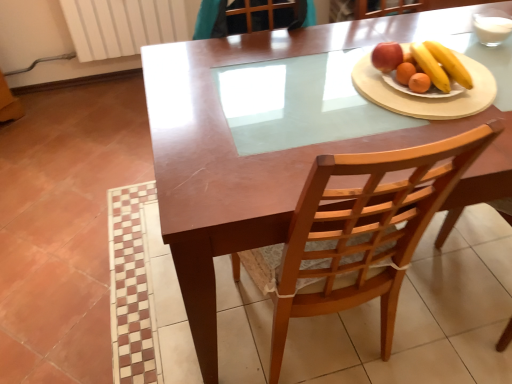
Question: From the image's perspective, is smooth wooden plate with fruits at right located above white ceramic plate at upper right?

Choices:
 (A) yes
 (B) no

Answer: (A)

Question: Would you say smooth wooden plate with fruits at right contains white ceramic plate at upper right?

Choices:
 (A) yes
 (B) no

Answer: (B)

Question: Is there a large distance between smooth wooden plate with fruits at right and white ceramic plate at upper right?

Choices:
 (A) yes
 (B) no

Answer: (B)

Question: Is smooth wooden plate with fruits at right wider than white ceramic plate at upper right?

Choices:
 (A) no
 (B) yes

Answer: (A)

Question: Does smooth wooden plate with fruits at right have a greater height compared to white ceramic plate at upper right?

Choices:
 (A) no
 (B) yes

Answer: (B)

Question: Considering the relative sizes of smooth wooden plate with fruits at right and white ceramic plate at upper right in the image provided, is smooth wooden plate with fruits at right bigger than white ceramic plate at upper right?

Choices:
 (A) yes
 (B) no

Answer: (B)

Question: Is smooth wooden plate with fruits at right positioned beyond the bounds of wooden chair at center?

Choices:
 (A) no
 (B) yes

Answer: (B)

Question: Does smooth wooden plate with fruits at right come in front of wooden chair at center?

Choices:
 (A) no
 (B) yes

Answer: (A)

Question: Can you confirm if smooth wooden plate with fruits at right is wider than wooden chair at center?

Choices:
 (A) yes
 (B) no

Answer: (B)

Question: From the image's perspective, is smooth wooden plate with fruits at right below wooden chair at center?

Choices:
 (A) no
 (B) yes

Answer: (A)

Question: Is smooth wooden plate with fruits at right at the right side of wooden chair at center?

Choices:
 (A) yes
 (B) no

Answer: (A)

Question: Does smooth wooden plate with fruits at right have a lesser height compared to wooden chair at center?

Choices:
 (A) no
 (B) yes

Answer: (B)

Question: From the image's perspective, is white ceramic plate at upper right located above wooden chair at center?

Choices:
 (A) yes
 (B) no

Answer: (A)